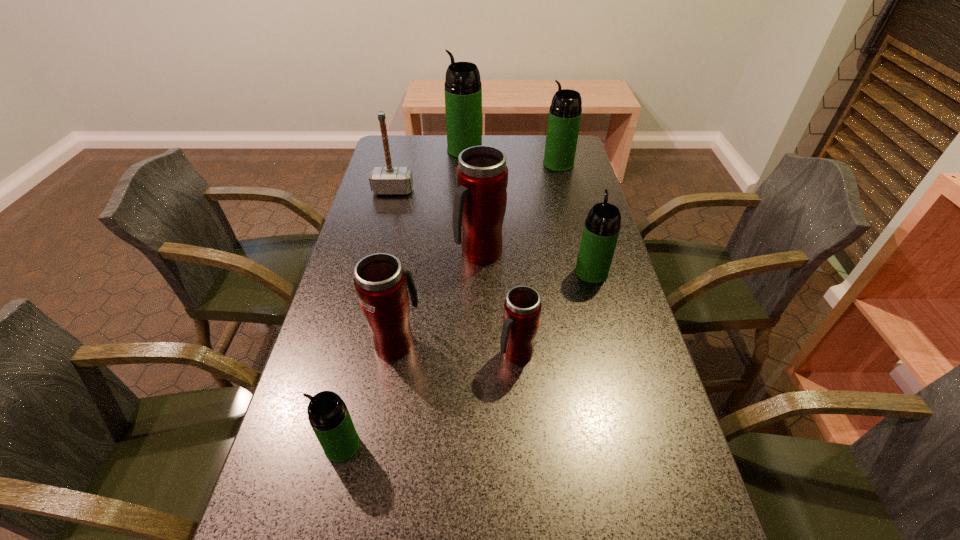
The image size is (960, 540). In order to click on the leftmost green thermos bottle in this screenshot , I will do `click(328, 415)`.

Locate an element on the screen. The height and width of the screenshot is (540, 960). free space located from the spout of the tallest thermos bottle is located at coordinates (402, 150).

Locate an element on the screen. vacant area situated from the spout of the tallest thermos bottle is located at coordinates (405, 150).

Where is `blank space located from the spout of the tallest thermos bottle`? This screenshot has height=540, width=960. blank space located from the spout of the tallest thermos bottle is located at coordinates pos(395,150).

This screenshot has width=960, height=540. In order to click on vacant space located 0.210m from the spout of the third smallest green thermos bottle in this screenshot , I will do `click(486, 164)`.

The height and width of the screenshot is (540, 960). I want to click on free space located from the spout of the third smallest green thermos bottle, so click(x=499, y=164).

This screenshot has width=960, height=540. I want to click on vacant space located 0.130m from the spout of the third smallest green thermos bottle, so click(x=508, y=164).

Where is `vacant space located 0.180m on the side with the handle of the farthest red thermos bottle`? This screenshot has height=540, width=960. vacant space located 0.180m on the side with the handle of the farthest red thermos bottle is located at coordinates click(x=480, y=322).

Identify the location of free space located 0.050m on the striking surface of the sixth nearest object. (389, 206).

I want to click on free space located 0.250m from the spout of the second nearest green thermos bottle, so click(x=575, y=209).